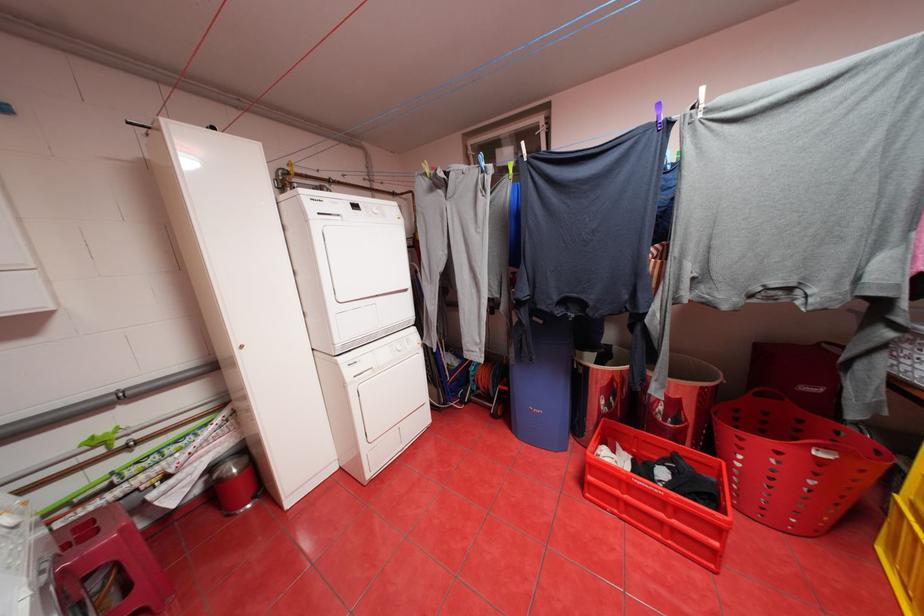
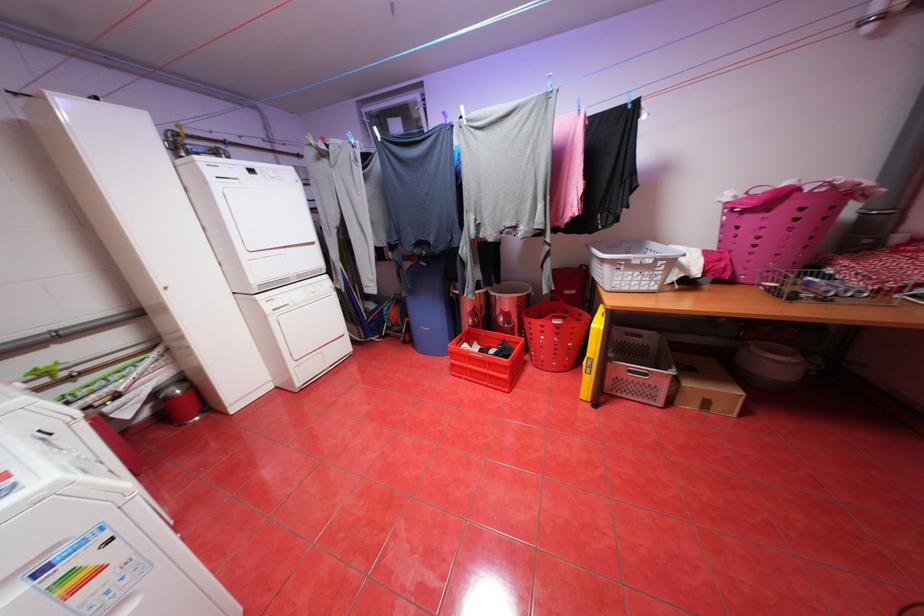
Locate, in the second image, the point that corresponds to point (631, 448) in the first image.

(488, 344)